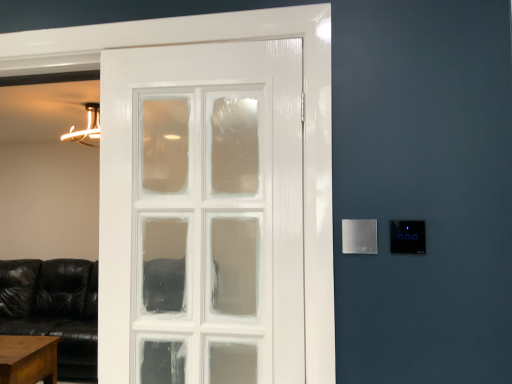
Question: Could brown wooden table at lower left be considered to be inside satin silver panel at right, marked as the 2th light switch in a right-to-left arrangement?

Choices:
 (A) yes
 (B) no

Answer: (B)

Question: Considering the relative sizes of satin silver panel at right, marked as the 2th light switch in a right-to-left arrangement, and brown wooden table at lower left in the image provided, is satin silver panel at right, marked as the 2th light switch in a right-to-left arrangement, bigger than brown wooden table at lower left?

Choices:
 (A) no
 (B) yes

Answer: (A)

Question: Is the depth of satin silver panel at right, the 1th light switch from the left, greater than that of brown wooden table at lower left?

Choices:
 (A) no
 (B) yes

Answer: (A)

Question: From a real-world perspective, is satin silver panel at right, the 1th light switch from the left, physically below brown wooden table at lower left?

Choices:
 (A) no
 (B) yes

Answer: (A)

Question: Can we say satin silver panel at right, marked as the 2th light switch in a right-to-left arrangement, lies outside brown wooden table at lower left?

Choices:
 (A) no
 (B) yes

Answer: (B)

Question: From the image's perspective, is satin silver panel at right, marked as the 2th light switch in a right-to-left arrangement, on top of brown wooden table at lower left?

Choices:
 (A) no
 (B) yes

Answer: (B)

Question: Does brown wooden table at lower left lie behind satin silver panel at right, which is the 1th light switch in right-to-left order?

Choices:
 (A) yes
 (B) no

Answer: (A)

Question: Considering the relative sizes of brown wooden table at lower left and satin silver panel at right, which is the 1th light switch in right-to-left order, in the image provided, is brown wooden table at lower left smaller than satin silver panel at right, which is the 1th light switch in right-to-left order,?

Choices:
 (A) yes
 (B) no

Answer: (B)

Question: Is brown wooden table at lower left taller than satin silver panel at right, which is the 1th light switch in right-to-left order?

Choices:
 (A) yes
 (B) no

Answer: (A)

Question: Is brown wooden table at lower left aimed at satin silver panel at right, arranged as the 2th light switch when viewed from the left?

Choices:
 (A) no
 (B) yes

Answer: (A)

Question: Is brown wooden table at lower left not within satin silver panel at right, which is the 1th light switch in right-to-left order?

Choices:
 (A) no
 (B) yes

Answer: (B)

Question: Considering the relative sizes of brown wooden table at lower left and satin silver panel at right, which is the 1th light switch in right-to-left order, in the image provided, is brown wooden table at lower left shorter than satin silver panel at right, which is the 1th light switch in right-to-left order,?

Choices:
 (A) yes
 (B) no

Answer: (B)

Question: From the image's perspective, is satin silver panel at right, arranged as the 2th light switch when viewed from the left, below satin silver panel at right, marked as the 2th light switch in a right-to-left arrangement?

Choices:
 (A) yes
 (B) no

Answer: (B)